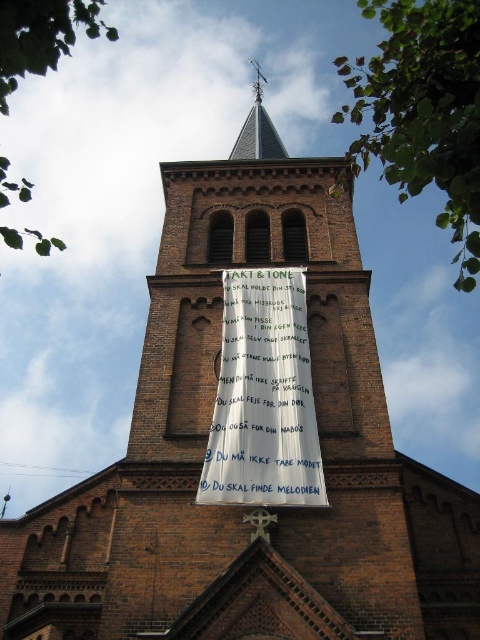
Is white paper banner at center above smooth gray spire at upper center?

No.

Is white paper banner at center below smooth gray spire at upper center?

Indeed, white paper banner at center is positioned under smooth gray spire at upper center.

Which is in front, point (240, 394) or point (252, 108)?

Point (240, 394)

The height and width of the screenshot is (640, 480). I want to click on white paper banner at center, so click(x=264, y=396).